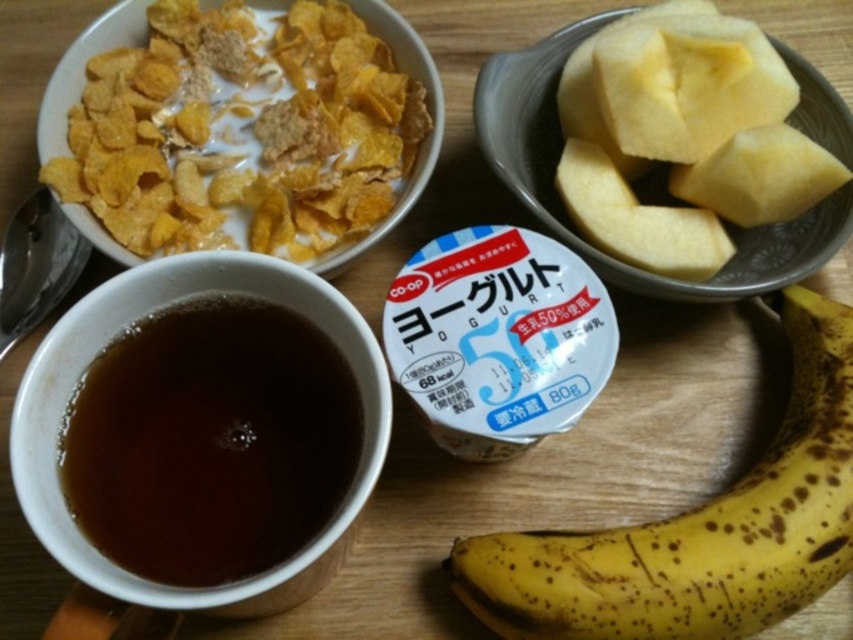
Where are the yellow matte corn flakes at upper left located?

The yellow matte corn flakes at upper left are located at point (241, 129).

You are arranging a picnic basket and need to know the spatial relationship between the brown matte cup at lower left and the yellow matte apple at upper right. Which object is closer to you when looking at the image?

The brown matte cup at lower left is closer to you because it is in front of the yellow matte apple at upper right.

You are a person with a height of 5 feet 6 inches. You want to grab the brown matte cup at lower left from your current position. Can you reach it without moving your feet?

The brown matte cup at lower left is 23.11 inches away from the viewer. Since the average arm length for a person of 5 feet 6 inches is about 25 inches, you can comfortably reach the brown matte cup at lower left without moving your feet.